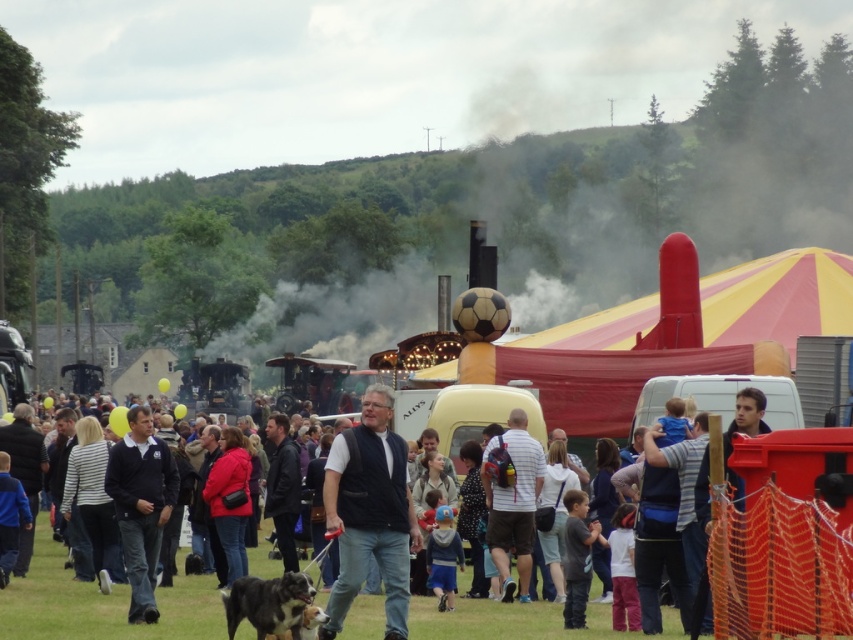
Who is more forward, (143, 408) or (518, 481)?

Positioned in front is point (143, 408).

Does dark blue jacket at center have a lesser height compared to white striped shirt at center?

In fact, dark blue jacket at center may be taller than white striped shirt at center.

Who is more distant from viewer, (160, 477) or (511, 442)?

Point (511, 442)

Find the location of a particular element. The width and height of the screenshot is (853, 640). dark blue jacket at center is located at coordinates (141, 506).

Between metallic steam at center and black and white fur dog at lower left, which one has more height?

metallic steam at center is taller.

Does metallic steam at center appear under black and white fur dog at lower left?

No.

This screenshot has width=853, height=640. I want to click on metallic steam at center, so click(627, 182).

Can you confirm if dark blue jeans at center is bigger than dark blue jacket at center?

Indeed, dark blue jeans at center has a larger size compared to dark blue jacket at center.

Can you confirm if dark blue jeans at center is positioned to the right of dark blue jacket at center?

Indeed, dark blue jeans at center is positioned on the right side of dark blue jacket at center.

Where is `dark blue jeans at center`? The width and height of the screenshot is (853, 640). dark blue jeans at center is located at coordinates (369, 513).